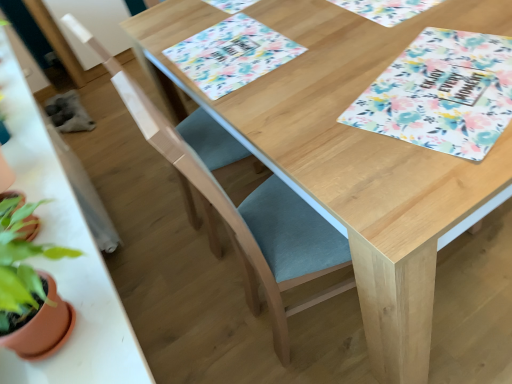
Question: Is wooden table at left positioned with its back to floral fabric placemat at upper center, which is the 2th place mat in left-to-right order?

Choices:
 (A) no
 (B) yes

Answer: (A)

Question: Is floral fabric placemat at upper center, which is the 2th place mat in left-to-right order, a part of wooden table at left?

Choices:
 (A) no
 (B) yes

Answer: (A)

Question: From a real-world perspective, is wooden table at left located beneath floral fabric placemat at upper center, which is the 2th place mat in left-to-right order?

Choices:
 (A) no
 (B) yes

Answer: (A)

Question: Can you confirm if wooden table at left is shorter than floral fabric placemat at upper center, which is the 2th place mat in left-to-right order?

Choices:
 (A) yes
 (B) no

Answer: (B)

Question: Considering the relative sizes of wooden table at left and floral fabric placemat at upper center, which is the 2th place mat in left-to-right order, in the image provided, is wooden table at left wider than floral fabric placemat at upper center, which is the 2th place mat in left-to-right order,?

Choices:
 (A) no
 (B) yes

Answer: (A)

Question: Is wooden table at left located outside floral fabric placemat at upper center, marked as the first place mat in a right-to-left arrangement?

Choices:
 (A) yes
 (B) no

Answer: (A)

Question: From the image's perspective, is wooden table at left beneath floral paper placemat at center, which is the 2th place mat from right to left?

Choices:
 (A) yes
 (B) no

Answer: (A)

Question: Considering the relative sizes of wooden table at left and floral paper placemat at center, the first place mat viewed from the left, in the image provided, is wooden table at left shorter than floral paper placemat at center, the first place mat viewed from the left,?

Choices:
 (A) yes
 (B) no

Answer: (B)

Question: Does wooden table at left contain floral paper placemat at center, the first place mat viewed from the left?

Choices:
 (A) no
 (B) yes

Answer: (A)

Question: Is wooden table at left thinner than floral paper placemat at center, the first place mat viewed from the left?

Choices:
 (A) no
 (B) yes

Answer: (B)

Question: Does wooden table at left lie in front of floral paper placemat at center, which is the 2th place mat from right to left?

Choices:
 (A) yes
 (B) no

Answer: (A)

Question: Does wooden table at left have a greater height compared to floral paper placemat at center, the first place mat viewed from the left?

Choices:
 (A) no
 (B) yes

Answer: (B)

Question: Is light blue fabric folding chair at center, the 1th folding chair in the front-to-back sequence, to the left of wooden table at left from the viewer's perspective?

Choices:
 (A) no
 (B) yes

Answer: (A)